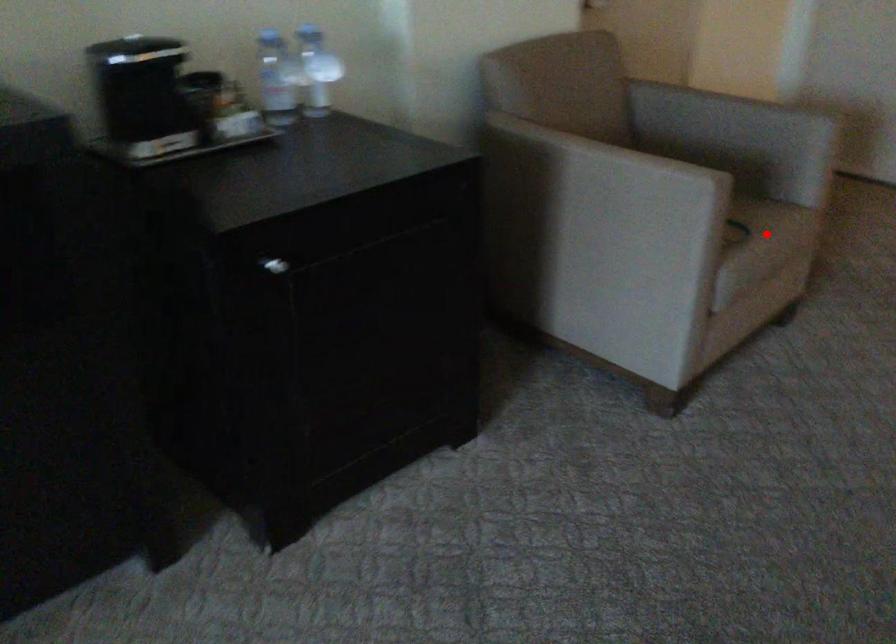
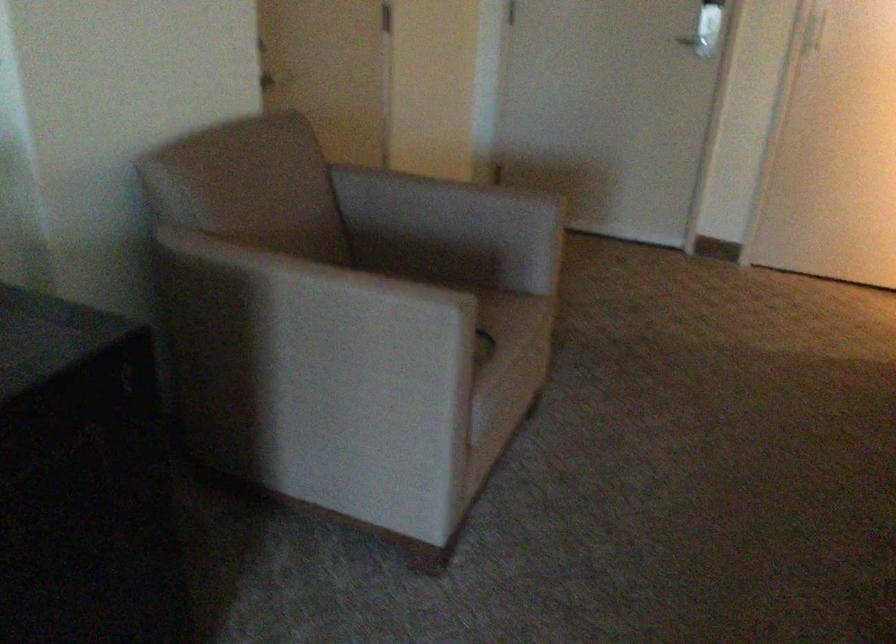
Where in the second image is the point corresponding to the highlighted location from the first image?

(513, 345)